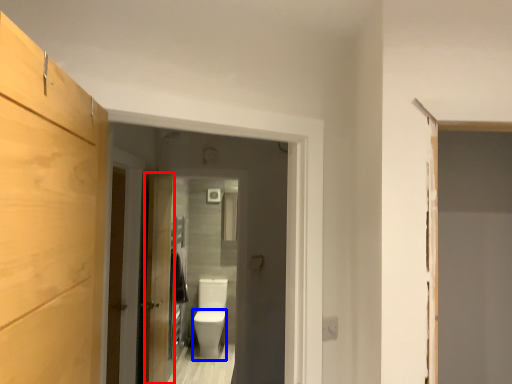
Question: Which object appears farthest to the camera in this image, door (highlighted by a red box) or toilet bowl (highlighted by a blue box)?

Choices:
 (A) door
 (B) toilet bowl

Answer: (B)